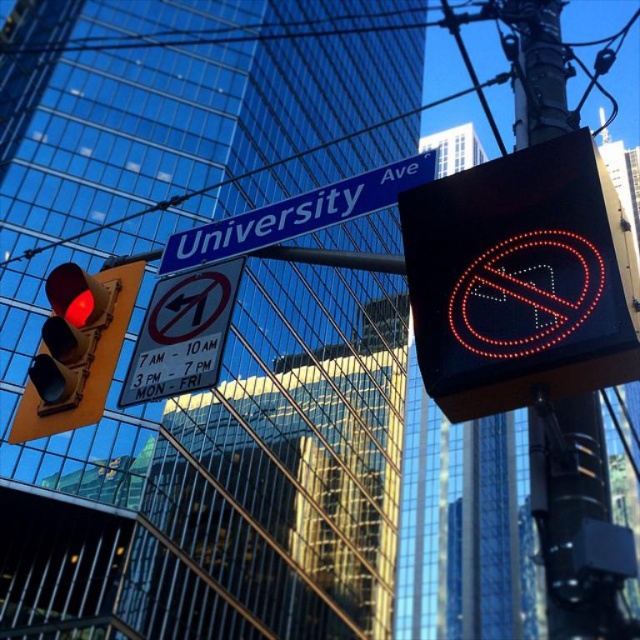
Is black led sign at upper right positioned at the back of black plastic sign at upper right?

No, black led sign at upper right is in front of black plastic sign at upper right.

The width and height of the screenshot is (640, 640). Describe the element at coordinates (522, 280) in the screenshot. I see `black led sign at upper right` at that location.

Is point (586, 358) positioned before point (515, 113)?

Yes, point (586, 358) is in front of point (515, 113).

Locate an element on the screen. The height and width of the screenshot is (640, 640). black led sign at upper right is located at coordinates (522, 280).

Consider the image. Between white plastic sign at center and blue metallic street sign at upper center, which one appears on the left side from the viewer's perspective?

Positioned to the left is white plastic sign at center.

Find the location of a particular element. This screenshot has height=640, width=640. white plastic sign at center is located at coordinates (182, 333).

The height and width of the screenshot is (640, 640). Describe the element at coordinates (522, 280) in the screenshot. I see `black led sign at upper right` at that location.

Does black led sign at upper right appear over white plastic sign at center?

Indeed, black led sign at upper right is positioned over white plastic sign at center.

Which is in front, point (442, 321) or point (180, 310)?

Point (442, 321)

This screenshot has height=640, width=640. I want to click on black led sign at upper right, so click(522, 280).